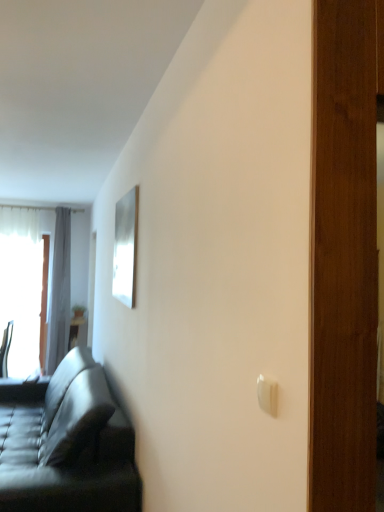
Question: Is metallic silver chair at left wider than leather couch at left?

Choices:
 (A) yes
 (B) no

Answer: (B)

Question: Is metallic silver chair at left at the right side of leather couch at left?

Choices:
 (A) no
 (B) yes

Answer: (A)

Question: Is metallic silver chair at left facing away from leather couch at left?

Choices:
 (A) yes
 (B) no

Answer: (B)

Question: Can you confirm if metallic silver chair at left is thinner than leather couch at left?

Choices:
 (A) no
 (B) yes

Answer: (B)

Question: Considering the relative sizes of metallic silver chair at left and leather couch at left in the image provided, is metallic silver chair at left shorter than leather couch at left?

Choices:
 (A) no
 (B) yes

Answer: (B)

Question: From a real-world perspective, is metallic silver chair at left above or below white plastic light switch at lower right?

Choices:
 (A) above
 (B) below

Answer: (B)

Question: Considering the positions of metallic silver chair at left and white plastic light switch at lower right in the image, is metallic silver chair at left bigger or smaller than white plastic light switch at lower right?

Choices:
 (A) big
 (B) small

Answer: (A)

Question: Considering the positions of metallic silver chair at left and white plastic light switch at lower right in the image, is metallic silver chair at left taller or shorter than white plastic light switch at lower right?

Choices:
 (A) tall
 (B) short

Answer: (A)

Question: Is metallic silver chair at left inside or outside of white plastic light switch at lower right?

Choices:
 (A) outside
 (B) inside

Answer: (A)

Question: In terms of size, does metallic silver chair at left appear bigger or smaller than leather couch at left?

Choices:
 (A) small
 (B) big

Answer: (A)

Question: Is point (3, 367) closer or farther from the camera than point (3, 384)?

Choices:
 (A) closer
 (B) farther

Answer: (B)

Question: Relative to leather couch at left, is metallic silver chair at left in front or behind?

Choices:
 (A) front
 (B) behind

Answer: (B)

Question: Choose the correct answer: Is metallic silver chair at left inside leather couch at left or outside it?

Choices:
 (A) outside
 (B) inside

Answer: (A)

Question: Is white plastic light switch at lower right taller or shorter than wooden table at left?

Choices:
 (A) tall
 (B) short

Answer: (B)

Question: Is white plastic light switch at lower right in front of or behind wooden table at left in the image?

Choices:
 (A) front
 (B) behind

Answer: (A)